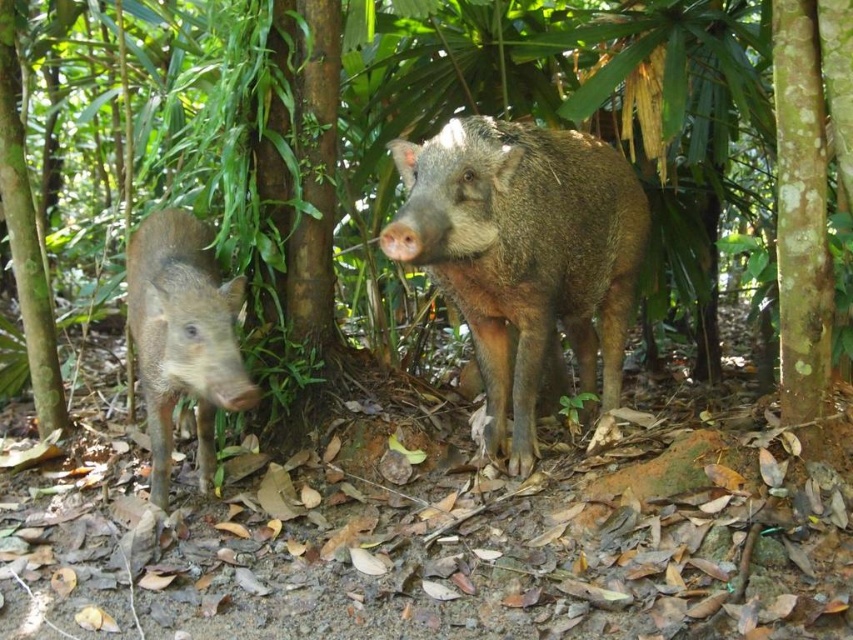
Which is more to the left, brown rough textured pig at center or brown matte pig at left?

From the viewer's perspective, brown matte pig at left appears more on the left side.

Image resolution: width=853 pixels, height=640 pixels. I want to click on brown rough textured pig at center, so click(524, 253).